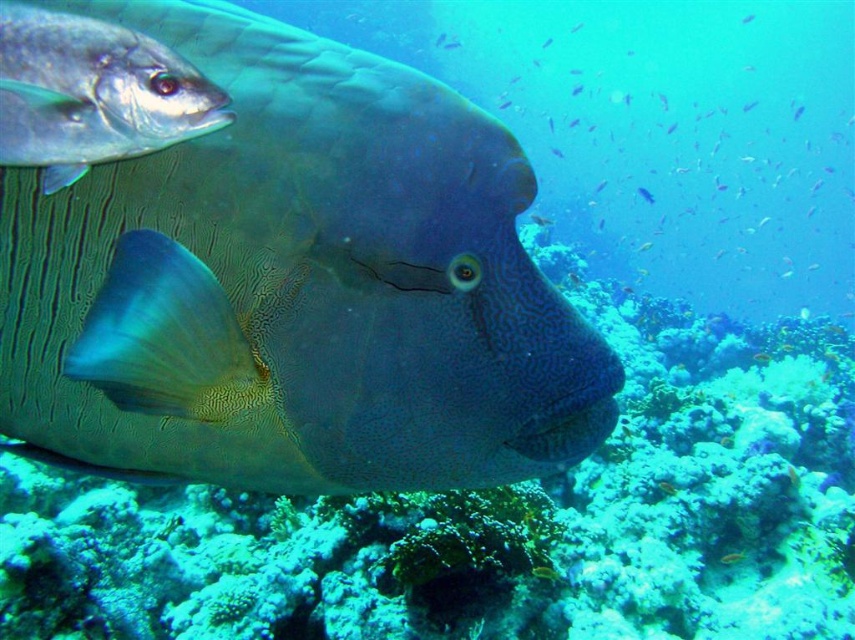
Does point (657, 417) lie in front of point (24, 102)?

No, (657, 417) is further to viewer.

Between textured coral reef at center and shiny silver fish at upper left, which one has less height?

shiny silver fish at upper left

The width and height of the screenshot is (855, 640). What do you see at coordinates (496, 518) in the screenshot? I see `textured coral reef at center` at bounding box center [496, 518].

At what (x,y) coordinates should I click in order to perform the action: click on textured coral reef at center. Please return your answer as a coordinate pair (x, y). Looking at the image, I should click on tap(496, 518).

Does shiny silver fish at upper left lie in front of satin blue fish at center?

Yes, it is in front of satin blue fish at center.

Who is taller, shiny silver fish at upper left or satin blue fish at center?

satin blue fish at center is taller.

Locate an element on the screen. Image resolution: width=855 pixels, height=640 pixels. shiny silver fish at upper left is located at coordinates (93, 93).

Which is more to the right, textured coral reef at center or shiny yellow fish at center?

Positioned to the right is shiny yellow fish at center.

Find the location of a particular element. The width and height of the screenshot is (855, 640). textured coral reef at center is located at coordinates tap(496, 518).

The width and height of the screenshot is (855, 640). I want to click on textured coral reef at center, so click(x=496, y=518).